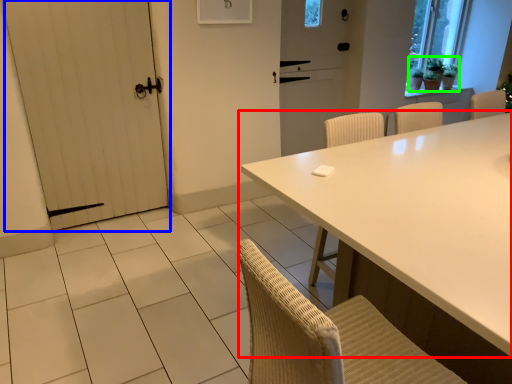
Question: Considering the real-world distances, which object is farthest from table (highlighted by a red box)? door (highlighted by a blue box) or plant (highlighted by a green box)?

Choices:
 (A) door
 (B) plant

Answer: (B)